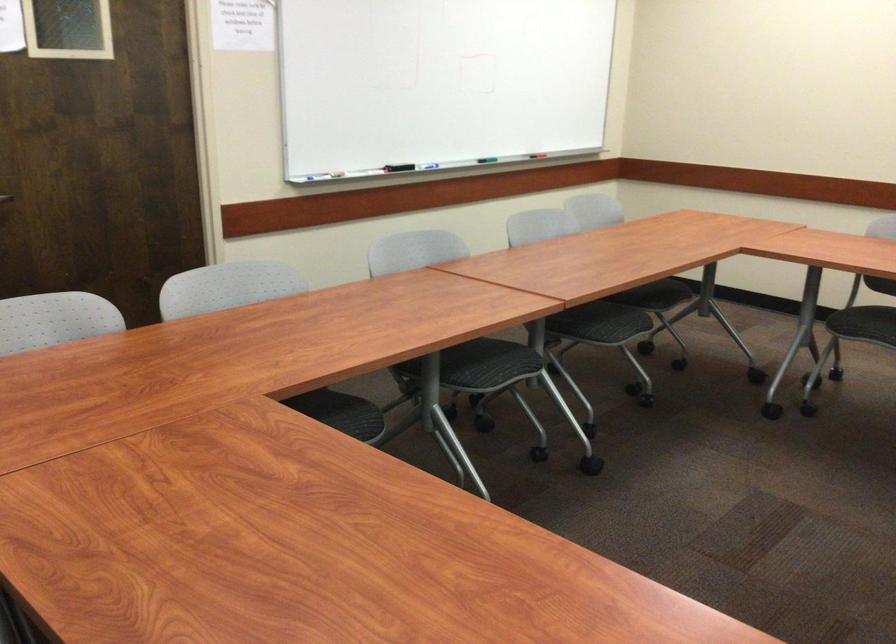
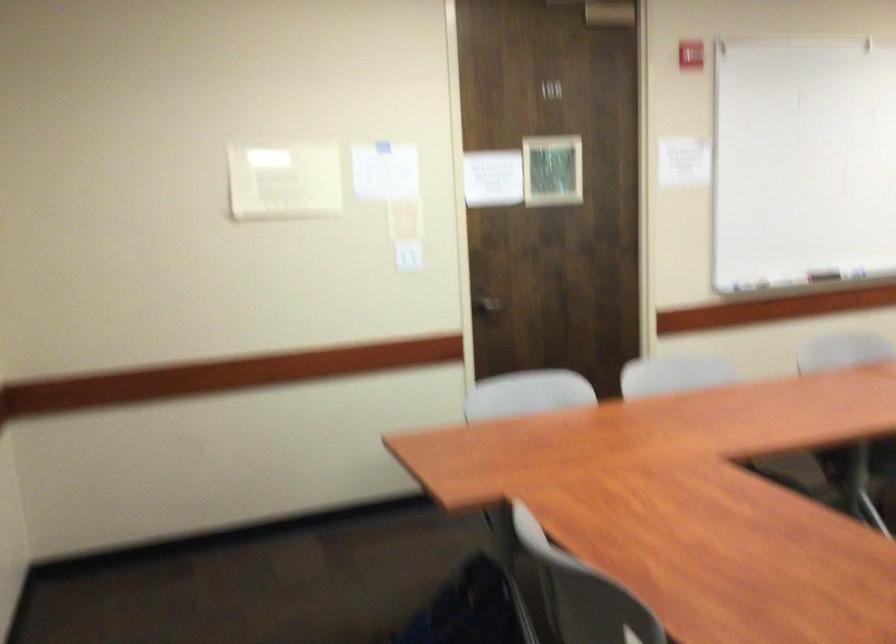
Question: The images are taken continuously from a first-person perspective. In which direction is your viewpoint rotating?

Choices:
 (A) Left
 (B) Right
 (C) Up
 (D) Down

Answer: (A)